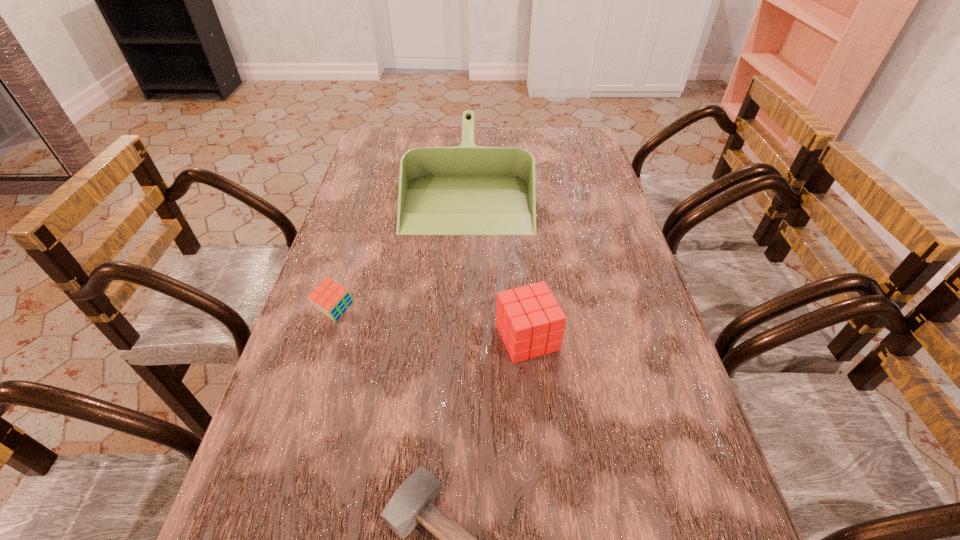
The height and width of the screenshot is (540, 960). Identify the location of the farthest object. (463, 190).

Locate an element on the screen. the right cube is located at coordinates pyautogui.click(x=530, y=321).

The image size is (960, 540). What are the coordinates of `the second shortest object` in the screenshot? It's located at pyautogui.click(x=329, y=297).

You are a GUI agent. You are given a task and a screenshot of the screen. Output one action in this format:
    pyautogui.click(x=<x>, y=<y>)
    Task: Click on the shorter cube
    The height and width of the screenshot is (540, 960).
    Given the screenshot: What is the action you would take?
    pyautogui.click(x=329, y=297)

Identify the location of vacant space located on the scoop of the dustpan. (464, 308).

The height and width of the screenshot is (540, 960). I want to click on vacant area located 0.090m on the right of the right cube, so click(x=599, y=338).

The width and height of the screenshot is (960, 540). Find the location of `vacant space situated 0.150m on the right of the left cube`. vacant space situated 0.150m on the right of the left cube is located at coordinates (420, 312).

You are a GUI agent. You are given a task and a screenshot of the screen. Output one action in this format:
    pyautogui.click(x=<x>, y=<y>)
    Task: Click on the object that is at the far edge
    
    Given the screenshot: What is the action you would take?
    pyautogui.click(x=463, y=190)

At what (x,y) coordinates should I click in order to perform the action: click on dustpan situated at the left edge. Please return your answer as a coordinate pair (x, y). Looking at the image, I should click on (463, 190).

Where is `cube present at the left edge`? cube present at the left edge is located at coordinates tap(329, 297).